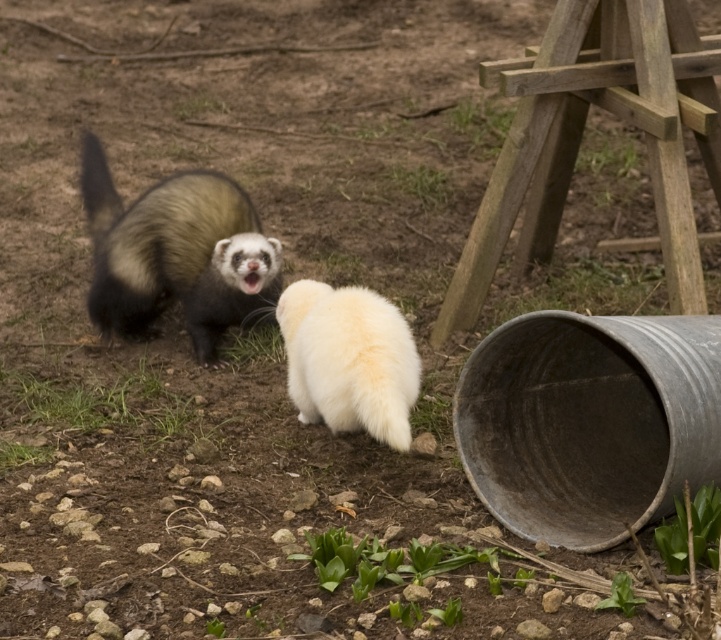
Based on the photo, you are standing at the center of the enclosure and see the point marked at coordinates (580, 134). What object is located at that point?

The point marked at coordinates (580, 134) is located at the wooden structure at right.